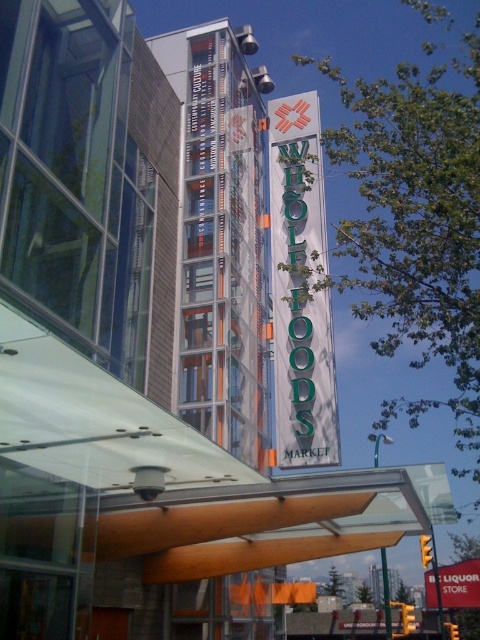
You are a delivery driver who needs to deliver a package to the Whole Foods Market. The building has a modern design with large glass windows and a green matte sign at upper center. Where should you look for the entrance to the Whole Foods Market?

The entrance to the Whole Foods Market is likely located near the green matte sign at upper center, which is positioned at coordinates [300,289] on the building facade.

You are a delivery driver who needs to park your truck near the Whole Foods Market. The parking lot has a height restriction of 12 feet. The green matte sign at upper center is 10 feet tall, and the red plastic sign at upper center is 8 feet tall. Can both signs fit under the height restriction?

Both the green matte sign at upper center and the red plastic sign at upper center can fit under the 12 feet height restriction since the tallest sign is 10 feet, which is below the limit.